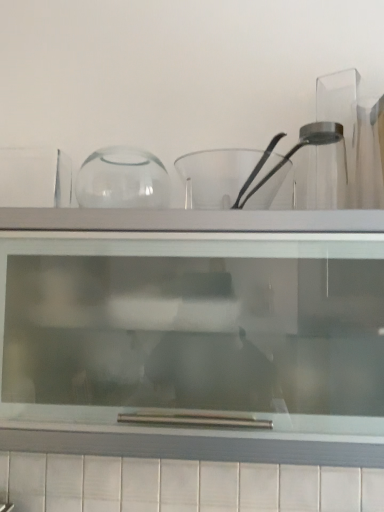
Measure the distance between point (347,352) and camera.

Point (347,352) and camera are 32.56 inches apart.

Describe the element at coordinates (193, 333) in the screenshot. The height and width of the screenshot is (512, 384). I see `transparent glass shelf at upper center` at that location.

You are a GUI agent. You are given a task and a screenshot of the screen. Output one action in this format:
    pyautogui.click(x=<x>, y=<y>)
    Task: Click on the transparent glass shelf at upper center
    
    Given the screenshot: What is the action you would take?
    pyautogui.click(x=193, y=333)

At what (x,y) coordinates should I click in order to perform the action: click on transparent glass bowl at center. Please return your answer as a coordinate pair (x, y). The height and width of the screenshot is (512, 384). Looking at the image, I should click on (215, 176).

In order to face transparent glass bowl at center, should I rotate leftwards or rightwards?

You should look right and rotate roughly 4.590 degrees.

What do you see at coordinates (215, 176) in the screenshot?
I see `transparent glass bowl at center` at bounding box center [215, 176].

Identify the location of transparent glass shelf at upper center. The width and height of the screenshot is (384, 512). (193, 333).

Consider the image. Does transparent glass shelf at upper center appear on the left side of transparent glass bowl at center?

Indeed, transparent glass shelf at upper center is positioned on the left side of transparent glass bowl at center.

Is transparent glass shelf at upper center in front of transparent glass bowl at center?

Yes, the depth of transparent glass shelf at upper center is less than that of transparent glass bowl at center.

Is point (224, 334) in front of point (194, 186)?

Yes.

From the image's perspective, is transparent glass shelf at upper center above transparent glass bowl at center?

No, from the image's perspective, transparent glass shelf at upper center is not above transparent glass bowl at center.

From a real-world perspective, who is located higher, transparent glass shelf at upper center or transparent glass bowl at center?

In real-world perspective, transparent glass bowl at center is above.

Based on the photo, which object is thinner, transparent glass shelf at upper center or transparent glass bowl at center?

transparent glass bowl at center.

Between transparent glass shelf at upper center and transparent glass bowl at center, which one has less height?

transparent glass bowl at center.

Who is smaller, transparent glass shelf at upper center or transparent glass bowl at center?

transparent glass bowl at center is smaller.

Is transparent glass shelf at upper center positioned beyond the bounds of transparent glass bowl at center?

Yes, transparent glass shelf at upper center is located beyond the bounds of transparent glass bowl at center.

Are transparent glass shelf at upper center and transparent glass bowl at center located far from each other?

transparent glass shelf at upper center is actually quite close to transparent glass bowl at center.

Is transparent glass shelf at upper center looking in the opposite direction of transparent glass bowl at center?

No.

I want to click on shelf in front of the transparent glass bowl at center, so pyautogui.click(x=193, y=333).

Between transparent glass bowl at center and transparent glass shelf at upper center, which one appears on the right side from the viewer's perspective?

transparent glass bowl at center.

Considering the positions of objects transparent glass bowl at center and transparent glass shelf at upper center in the image provided, who is in front, transparent glass bowl at center or transparent glass shelf at upper center?

transparent glass shelf at upper center is in front.

Is point (208, 173) farther from viewer compared to point (207, 221)?

Yes.

From the image's perspective, is transparent glass bowl at center located beneath transparent glass shelf at upper center?

→ No.

From a real-world perspective, relative to transparent glass shelf at upper center, is transparent glass bowl at center vertically above or below?

Clearly, from a real-world perspective, transparent glass bowl at center is above transparent glass shelf at upper center.

Considering the sizes of transparent glass bowl at center and transparent glass shelf at upper center in the image, is transparent glass bowl at center wider or thinner than transparent glass shelf at upper center?

Considering their sizes, transparent glass bowl at center looks slimmer than transparent glass shelf at upper center.

Considering the relative sizes of transparent glass bowl at center and transparent glass shelf at upper center in the image provided, is transparent glass bowl at center taller than transparent glass shelf at upper center?

No.

Is transparent glass bowl at center bigger than transparent glass shelf at upper center?

Incorrect, transparent glass bowl at center is not larger than transparent glass shelf at upper center.

Looking at this image, would you say transparent glass shelf at upper center is part of transparent glass bowl at center's contents?

Definitely not — transparent glass shelf at upper center is not inside transparent glass bowl at center.

Is transparent glass bowl at center beside transparent glass shelf at upper center?

There is a gap between transparent glass bowl at center and transparent glass shelf at upper center.

From the picture: Is transparent glass bowl at center looking in the opposite direction of transparent glass shelf at upper center?

No, transparent glass bowl at center is not facing the opposite direction of transparent glass shelf at upper center.

Where is `shelf on the left of transparent glass bowl at center`? shelf on the left of transparent glass bowl at center is located at coordinates (193, 333).

Locate an element on the screen. bowl above the transparent glass shelf at upper center (from a real-world perspective) is located at coordinates (215, 176).

Locate an element on the screen. shelf that appears in front of the transparent glass bowl at center is located at coordinates (193, 333).